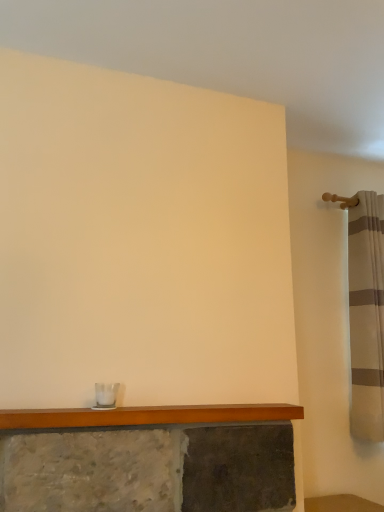
Measure the distance between wooden mantle at lower center and camera.

4.54 feet.

The height and width of the screenshot is (512, 384). Describe the element at coordinates (147, 416) in the screenshot. I see `wooden mantle at lower center` at that location.

Where is `wooden mantle at lower center`? wooden mantle at lower center is located at coordinates (147, 416).

Identify the location of striped fabric shower curtain at right. pos(366,315).

What do you see at coordinates (366, 315) in the screenshot? This screenshot has width=384, height=512. I see `striped fabric shower curtain at right` at bounding box center [366, 315].

The image size is (384, 512). I want to click on wooden mantle at lower center, so click(147, 416).

Considering the relative positions of wooden mantle at lower center and striped fabric shower curtain at right in the image provided, is wooden mantle at lower center to the left of striped fabric shower curtain at right from the viewer's perspective?

Indeed, wooden mantle at lower center is positioned on the left side of striped fabric shower curtain at right.

Based on the photo, considering their positions, is wooden mantle at lower center located in front of or behind striped fabric shower curtain at right?

Visually, wooden mantle at lower center is located in front of striped fabric shower curtain at right.

Is point (128, 409) farther from camera compared to point (371, 264)?

That is False.

From the image's perspective, between wooden mantle at lower center and striped fabric shower curtain at right, who is located below?

wooden mantle at lower center is shown below in the image.

From a real-world perspective, which is physically above, wooden mantle at lower center or striped fabric shower curtain at right?

In real-world perspective, striped fabric shower curtain at right is above.

Does wooden mantle at lower center have a lesser width compared to striped fabric shower curtain at right?

Indeed, wooden mantle at lower center has a lesser width compared to striped fabric shower curtain at right.

Does wooden mantle at lower center have a greater height compared to striped fabric shower curtain at right?

No, wooden mantle at lower center is not taller than striped fabric shower curtain at right.

Is wooden mantle at lower center bigger than striped fabric shower curtain at right?

No.

Would you say wooden mantle at lower center contains striped fabric shower curtain at right?

No, striped fabric shower curtain at right is not surrounded by wooden mantle at lower center.

Is wooden mantle at lower center far away from striped fabric shower curtain at right?

They are positioned close to each other.

Does wooden mantle at lower center turn towards striped fabric shower curtain at right?

No, wooden mantle at lower center is not facing towards striped fabric shower curtain at right.

Where is `shower curtain on the right of wooden mantle at lower center`? Image resolution: width=384 pixels, height=512 pixels. shower curtain on the right of wooden mantle at lower center is located at coordinates (366, 315).

Considering the positions of objects striped fabric shower curtain at right and wooden mantle at lower center in the image provided, who is more to the left, striped fabric shower curtain at right or wooden mantle at lower center?

wooden mantle at lower center is more to the left.

Considering the positions of objects striped fabric shower curtain at right and wooden mantle at lower center in the image provided, who is in front, striped fabric shower curtain at right or wooden mantle at lower center?

wooden mantle at lower center is closer to the camera.

Considering the points (381, 249) and (207, 410), which point is in front, point (381, 249) or point (207, 410)?

The point (207, 410) is closer to the camera.

From the image's perspective, which is above, striped fabric shower curtain at right or wooden mantle at lower center?

striped fabric shower curtain at right, from the image's perspective.

From a real-world perspective, is striped fabric shower curtain at right above or below wooden mantle at lower center?

In terms of real-world spatial position, striped fabric shower curtain at right is above wooden mantle at lower center.

Which object is wider, striped fabric shower curtain at right or wooden mantle at lower center?

striped fabric shower curtain at right.

From their relative heights in the image, would you say striped fabric shower curtain at right is taller or shorter than wooden mantle at lower center?

In the image, striped fabric shower curtain at right appears to be taller than wooden mantle at lower center.

Can you confirm if striped fabric shower curtain at right is bigger than wooden mantle at lower center?

Indeed, striped fabric shower curtain at right has a larger size compared to wooden mantle at lower center.

From the picture: Is wooden mantle at lower center completely or partially inside striped fabric shower curtain at right?

No.

Would you consider striped fabric shower curtain at right to be distant from wooden mantle at lower center?

They are positioned close to each other.

Could you tell me if striped fabric shower curtain at right is facing wooden mantle at lower center?

No.

Locate an element on the screen. This screenshot has height=512, width=384. counter top lying on the left of striped fabric shower curtain at right is located at coordinates (147, 416).

Where is `shower curtain on the right of the wooden mantle at lower center`? Image resolution: width=384 pixels, height=512 pixels. shower curtain on the right of the wooden mantle at lower center is located at coordinates (366, 315).

Locate an element on the screen. counter top in front of the striped fabric shower curtain at right is located at coordinates (147, 416).